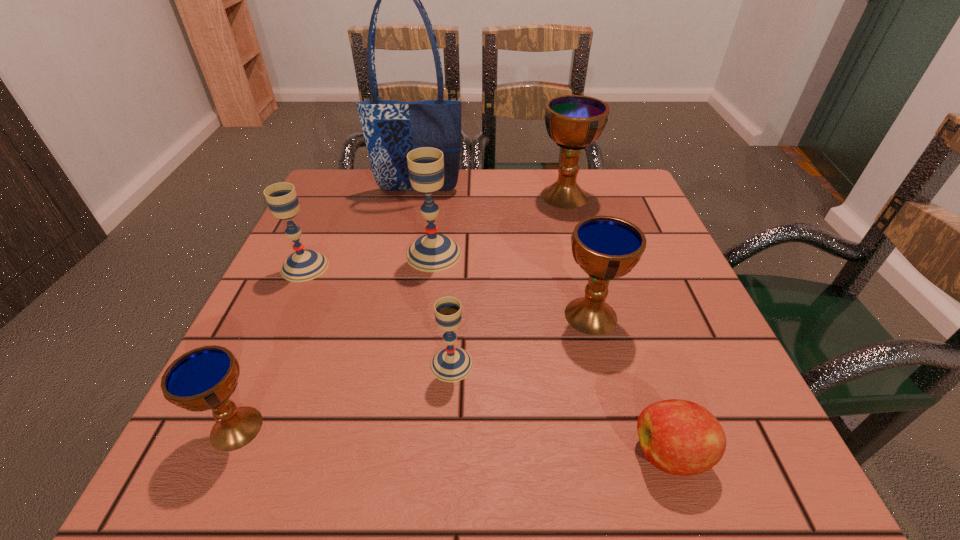
I want to click on free space located 0.200m on the left of the shortest object, so click(490, 454).

Locate an element on the screen. The image size is (960, 540). shopping bag present at the far edge is located at coordinates (391, 129).

You are a GUI agent. You are given a task and a screenshot of the screen. Output one action in this format:
    pyautogui.click(x=<x>, y=<y>)
    Task: Click on the chalice located at the far edge
    The image size is (960, 540).
    Given the screenshot: What is the action you would take?
    pyautogui.click(x=572, y=121)

I want to click on chalice positioned at the near edge, so click(204, 378).

The width and height of the screenshot is (960, 540). What are the coordinates of `apple at the near edge` in the screenshot? It's located at (679, 437).

Where is `shopping bag located in the left edge section of the desktop`? This screenshot has height=540, width=960. shopping bag located in the left edge section of the desktop is located at coordinates (391, 129).

This screenshot has width=960, height=540. Find the location of `apple that is at the right edge`. apple that is at the right edge is located at coordinates (679, 437).

The width and height of the screenshot is (960, 540). What are the coordinates of `object that is positioned at the far left corner` in the screenshot? It's located at (391, 129).

Locate an element on the screen. The image size is (960, 540). object that is at the near left corner is located at coordinates (204, 378).

Where is `object that is at the far right corner`? object that is at the far right corner is located at coordinates (572, 121).